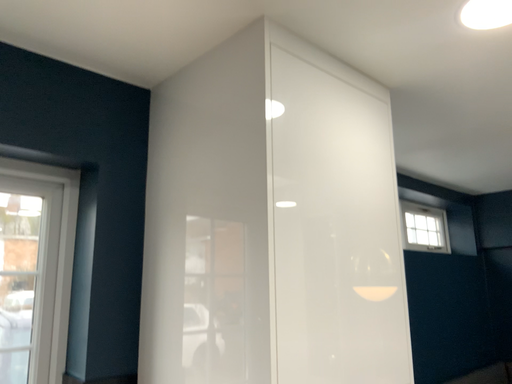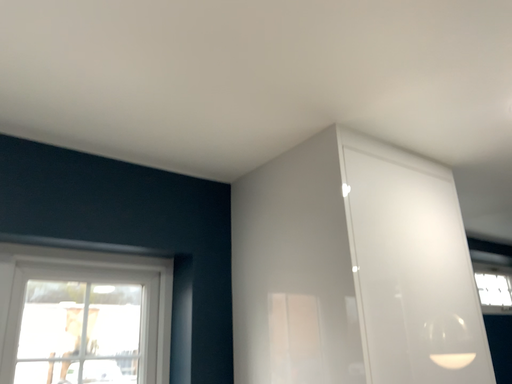
Question: Which way did the camera rotate in the video?

Choices:
 (A) rotated upward
 (B) rotated downward

Answer: (A)